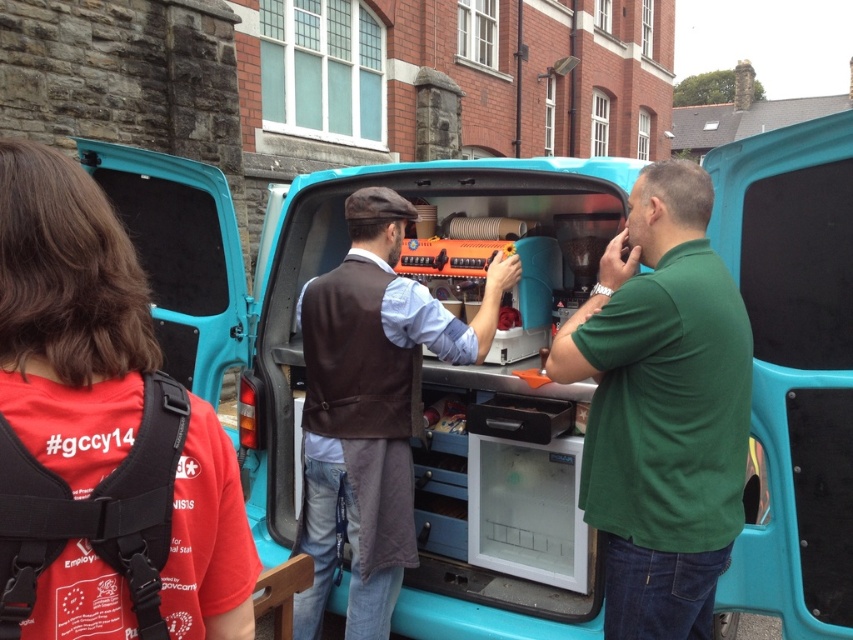
Question: Is green matte shirt at center further to camera compared to brown leather vest at center?

Choices:
 (A) no
 (B) yes

Answer: (A)

Question: Which point is closer to the camera?

Choices:
 (A) (602, 442)
 (B) (392, 378)

Answer: (A)

Question: Among these objects, which one is farthest from the camera?

Choices:
 (A) brown leather vest at center
 (B) green matte shirt at center

Answer: (A)

Question: Is green matte shirt at center positioned behind brown leather vest at center?

Choices:
 (A) no
 (B) yes

Answer: (A)

Question: Is green matte shirt at center closer to camera compared to brown leather vest at center?

Choices:
 (A) yes
 (B) no

Answer: (A)